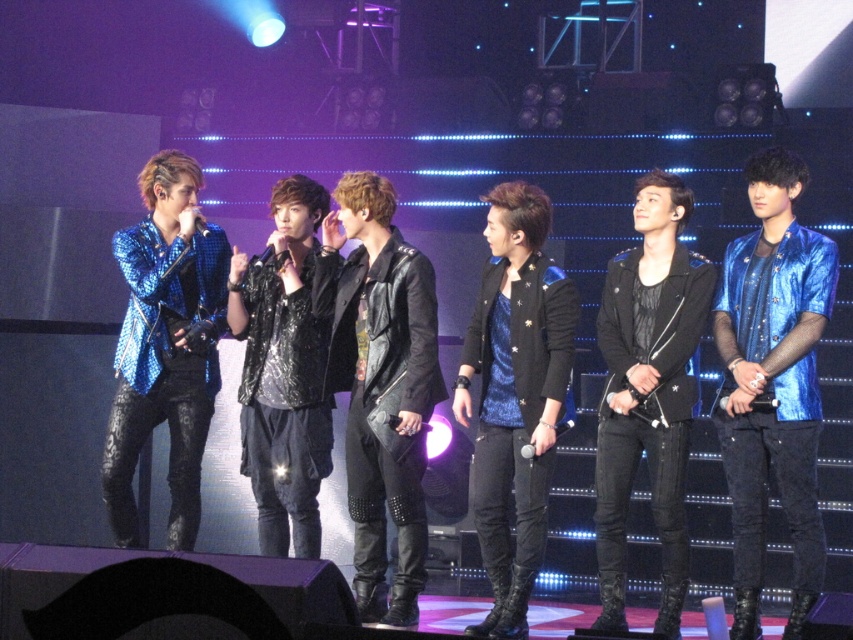
You are a photographer at the concert. You need to take a photo of both the shiny blue jacket at center and the leather jacket at center. Which jacket should you focus on first if you want to capture them from left to right order?

You should focus on the leather jacket at center first because the shiny blue jacket at center is to the right of it, so arranging them from left to right would place the leather jacket at center first followed by the shiny blue jacket at center.